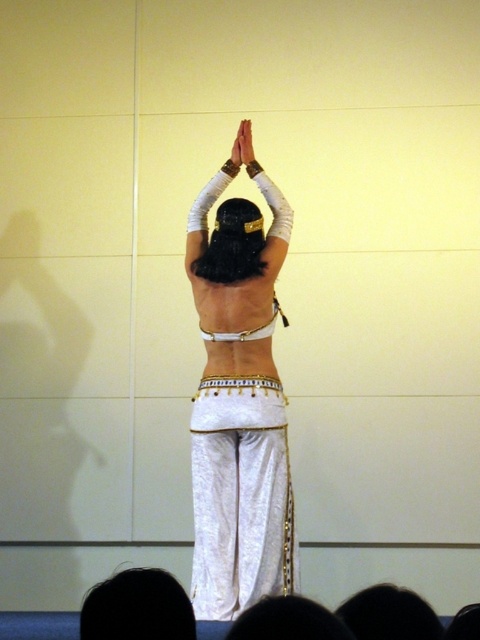
Question: Estimate the real-world distances between objects in this image. Which object is closer to the white matte arm at upper center?

Choices:
 (A) white satin arm at upper center
 (B) black fabric at lower right
 (C) white satin hand at upper center

Answer: (A)

Question: Is black hair at upper center positioned in front of white satin arm at upper center?

Choices:
 (A) no
 (B) yes

Answer: (B)

Question: Where is white satin belly dancer at center located in relation to white matte hand at upper center in the image?

Choices:
 (A) below
 (B) above

Answer: (A)

Question: Which of the following is the farthest from the observer?

Choices:
 (A) (211, 419)
 (B) (191, 246)

Answer: (B)

Question: Which point is closer to the camera taking this photo?

Choices:
 (A) pos(257,339)
 (B) pos(239,148)

Answer: (A)

Question: Does white satin bikini top at center come behind white satin hand at upper center?

Choices:
 (A) yes
 (B) no

Answer: (B)